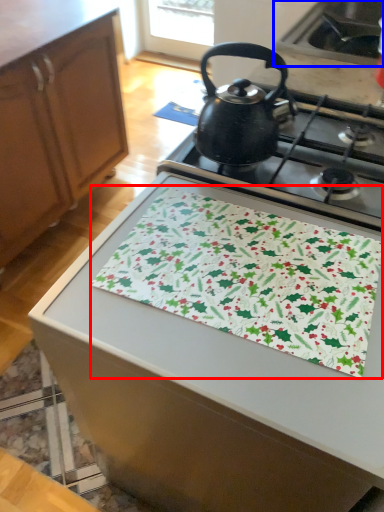
Question: Which point is closer to the camera, blanket (highlighted by a red box) or sink (highlighted by a blue box)?

Choices:
 (A) blanket
 (B) sink

Answer: (A)